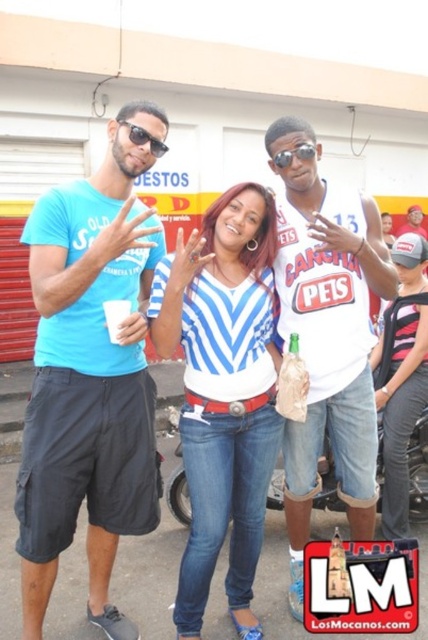
Consider the image. Who is higher up, black plastic sunglasses at center or sunglasses at center?

black plastic sunglasses at center is above.

Does black plastic sunglasses at center come in front of sunglasses at center?

No, it is behind sunglasses at center.

Does point (278, 152) come in front of point (130, 125)?

No, it is behind (130, 125).

At what (x,y) coordinates should I click in order to perform the action: click on black plastic sunglasses at center. Please return your answer as a coordinate pair (x, y). Image resolution: width=428 pixels, height=640 pixels. Looking at the image, I should click on (x=293, y=154).

Can you confirm if blue striped shirt at center is taller than sunglasses at center?

Indeed, blue striped shirt at center has a greater height compared to sunglasses at center.

Is blue striped shirt at center bigger than sunglasses at center?

Correct, blue striped shirt at center is larger in size than sunglasses at center.

Between point (249, 269) and point (158, 157), which one is positioned in front?

Positioned in front is point (249, 269).

You are a GUI agent. You are given a task and a screenshot of the screen. Output one action in this format:
    pyautogui.click(x=<x>, y=<y>)
    Task: Click on the blue striped shirt at center
    The height and width of the screenshot is (640, 428).
    Given the screenshot: What is the action you would take?
    pyautogui.click(x=222, y=392)

Which is above, white jersey at center or sunglasses at center?

sunglasses at center

Can you confirm if white jersey at center is positioned above sunglasses at center?

No.

Is point (359, 477) in front of point (124, 122)?

No, it is behind (124, 122).

At what (x,y) coordinates should I click in order to perform the action: click on white jersey at center. Please return your answer as a coordinate pair (x, y). This screenshot has width=428, height=640. Looking at the image, I should click on (327, 337).